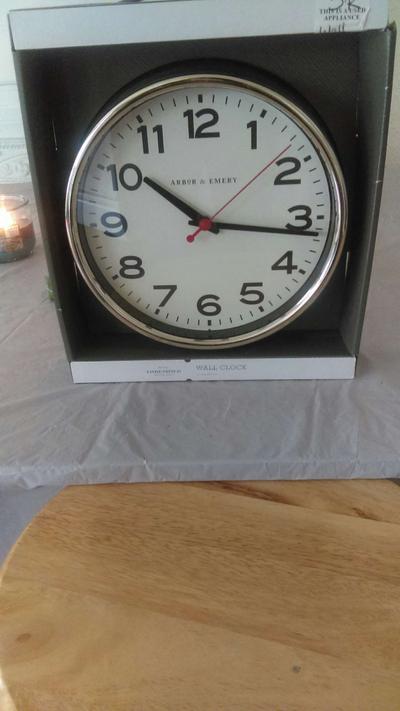
Locate an element on the screen. candle is located at coordinates (28, 234).